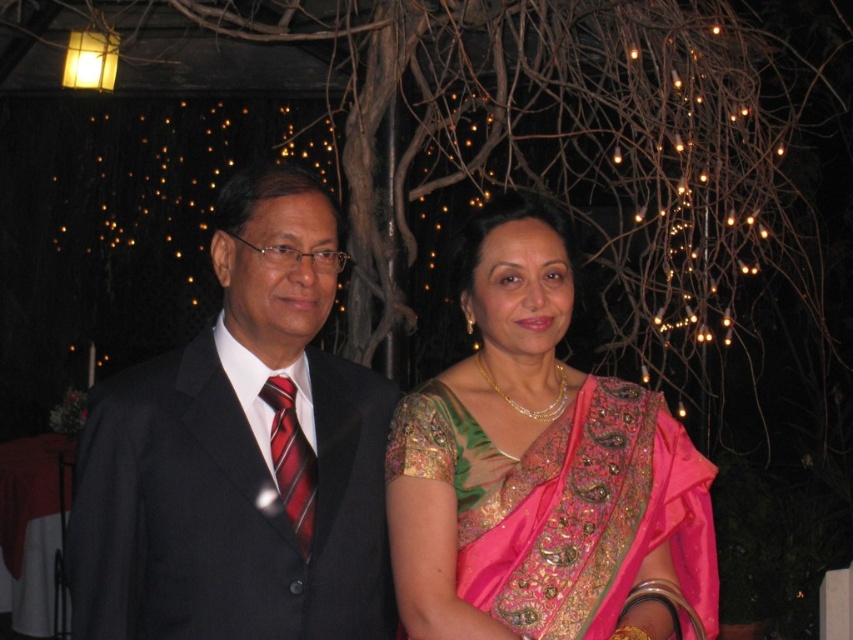
Question: Considering the relative positions of pink embroidered saree at center and red striped tie at left in the image provided, where is pink embroidered saree at center located with respect to red striped tie at left?

Choices:
 (A) below
 (B) above

Answer: (B)

Question: Considering the real-world distances, which object is closest to the pink embroidered saree at center?

Choices:
 (A) shiny black suit at left
 (B) red striped tie at left

Answer: (A)

Question: Does shiny black suit at left have a larger size compared to pink embroidered saree at center?

Choices:
 (A) yes
 (B) no

Answer: (A)

Question: Does shiny black suit at left appear under pink embroidered saree at center?

Choices:
 (A) no
 (B) yes

Answer: (A)

Question: Which of the following is the closest to the observer?

Choices:
 (A) shiny black suit at left
 (B) red striped tie at left
 (C) pink embroidered saree at center

Answer: (A)

Question: Which point is closer to the camera?

Choices:
 (A) shiny black suit at left
 (B) red striped tie at left
 (C) pink embroidered saree at center

Answer: (A)